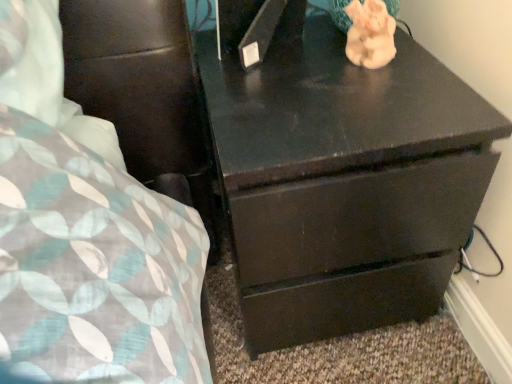
Question: From a real-world perspective, is dark wood chest of drawers at center under porcelain pink elephant at upper right?

Choices:
 (A) yes
 (B) no

Answer: (A)

Question: Can you confirm if dark wood chest of drawers at center is wider than porcelain pink elephant at upper right?

Choices:
 (A) yes
 (B) no

Answer: (A)

Question: From the image's perspective, is dark wood chest of drawers at center beneath porcelain pink elephant at upper right?

Choices:
 (A) no
 (B) yes

Answer: (B)

Question: Is there a large distance between dark wood chest of drawers at center and porcelain pink elephant at upper right?

Choices:
 (A) no
 (B) yes

Answer: (A)

Question: Is dark wood chest of drawers at center to the right of porcelain pink elephant at upper right from the viewer's perspective?

Choices:
 (A) yes
 (B) no

Answer: (B)

Question: Does dark wood chest of drawers at center lie in front of porcelain pink elephant at upper right?

Choices:
 (A) no
 (B) yes

Answer: (B)

Question: Is the depth of porcelain pink elephant at upper right less than that of dark wood chest of drawers at center?

Choices:
 (A) yes
 (B) no

Answer: (B)

Question: Can you confirm if porcelain pink elephant at upper right is thinner than dark wood chest of drawers at center?

Choices:
 (A) no
 (B) yes

Answer: (B)

Question: Is porcelain pink elephant at upper right turned away from dark wood chest of drawers at center?

Choices:
 (A) no
 (B) yes

Answer: (A)

Question: Considering the relative positions of porcelain pink elephant at upper right and dark wood chest of drawers at center in the image provided, is porcelain pink elephant at upper right to the right of dark wood chest of drawers at center from the viewer's perspective?

Choices:
 (A) yes
 (B) no

Answer: (A)

Question: Does porcelain pink elephant at upper right have a larger size compared to dark wood chest of drawers at center?

Choices:
 (A) no
 (B) yes

Answer: (A)

Question: Considering the relative sizes of porcelain pink elephant at upper right and dark wood chest of drawers at center in the image provided, is porcelain pink elephant at upper right wider than dark wood chest of drawers at center?

Choices:
 (A) no
 (B) yes

Answer: (A)

Question: Is point (349, 29) positioned closer to the camera than point (424, 218)?

Choices:
 (A) closer
 (B) farther

Answer: (B)